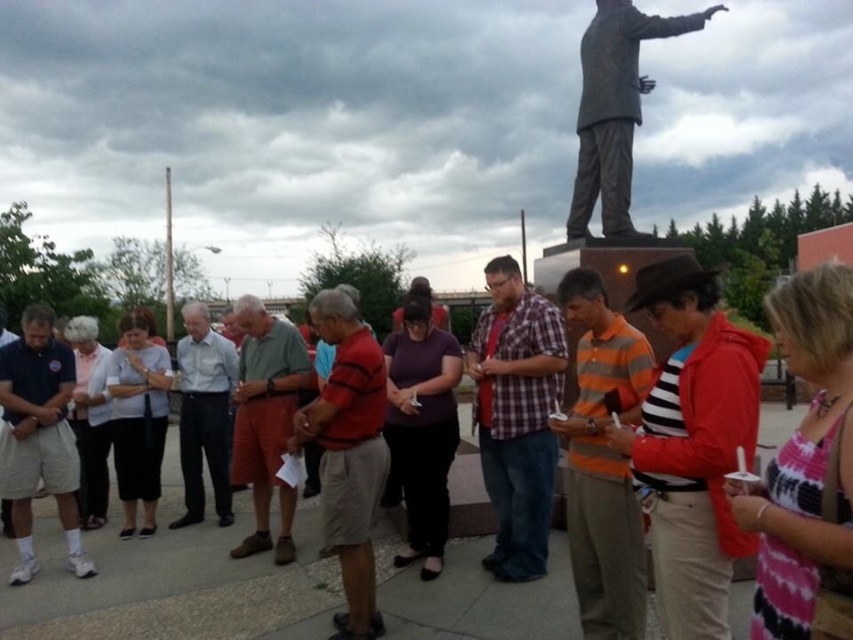
Is point (518, 428) positioned behind point (370, 602)?

That is True.

Who is lower down, plaid fabric shirt at center or red striped shirt at center?

red striped shirt at center

Who is more forward, [556,352] or [363,564]?

Point [363,564] is more forward.

Identify the location of plaid fabric shirt at center. Image resolution: width=853 pixels, height=640 pixels. (515, 416).

Can you confirm if white cotton shorts at left is smaller than light blue shirt at center?

No.

Who is taller, white cotton shorts at left or light blue shirt at center?

white cotton shorts at left is taller.

Who is more distant from viewer, [15,442] or [219,515]?

The point [219,515] is behind.

The height and width of the screenshot is (640, 853). In order to click on white cotton shorts at left in this screenshot , I will do `click(38, 436)`.

Which is behind, point (112, 580) or point (219, 381)?

Positioned behind is point (219, 381).

Measure the distance between matte red shirt at center and camera.

They are 4.32 meters apart.

Where is `matte red shirt at center`? The image size is (853, 640). matte red shirt at center is located at coordinates (173, 588).